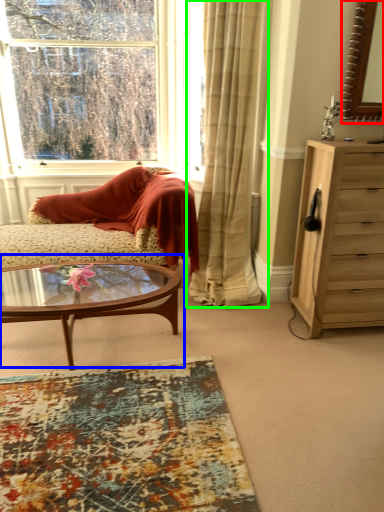
Question: Which object is the farthest from mirror (highlighted by a red box)? Choose among these: coffee table (highlighted by a blue box) or curtain (highlighted by a green box).

Choices:
 (A) coffee table
 (B) curtain

Answer: (A)